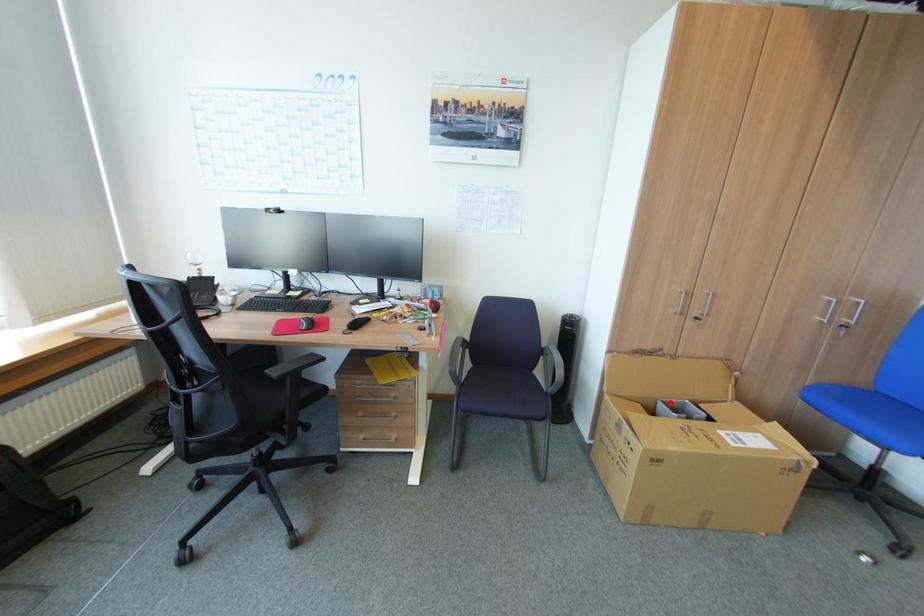
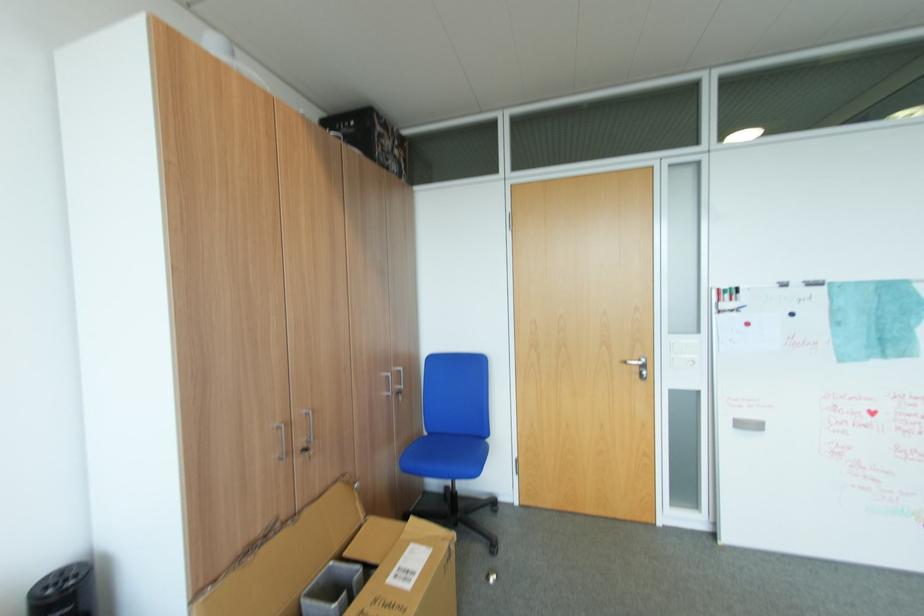
Question: I am providing you with two images of the same scene from different viewpoints. A red point is marked on the first image. Can you still see the location of the red point in image 2?

Choices:
 (A) Yes
 (B) No

Answer: (A)